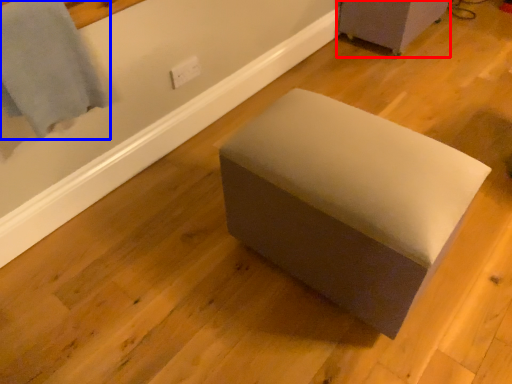
Question: Which of the following is the farthest to the observer, furniture (highlighted by a red box) or bath towel (highlighted by a blue box)?

Choices:
 (A) furniture
 (B) bath towel

Answer: (A)